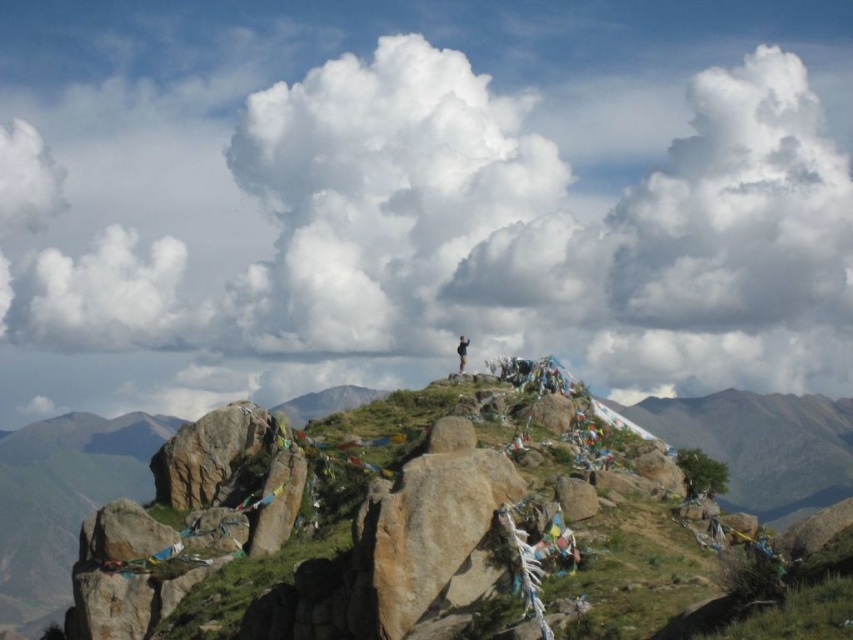
Based on the photo, is rusty rock at center in front of smooth brown rock at center?

No.

Which is in front, point (178, 480) or point (577, 520)?

Point (577, 520)

Locate an element on the screen. The image size is (853, 640). rusty rock at center is located at coordinates (209, 454).

Does rusty rock at center have a smaller size compared to black fabric person at center?

No, rusty rock at center is not smaller than black fabric person at center.

Which of these two, rusty rock at center or black fabric person at center, stands shorter?

black fabric person at center is shorter.

Looking at this image, who is more forward, (186, 422) or (462, 355)?

Point (462, 355)

You are a GUI agent. You are given a task and a screenshot of the screen. Output one action in this format:
    pyautogui.click(x=<x>, y=<y>)
    Task: Click on the rusty rock at center
    
    Given the screenshot: What is the action you would take?
    tap(209, 454)

Does point (556, 483) come closer to viewer compared to point (460, 368)?

Yes, point (556, 483) is in front of point (460, 368).

Does smooth brown rock at center have a greater height compared to black fabric person at center?

No.

Between point (561, 508) and point (459, 365), which one is positioned behind?

Point (459, 365)

Find the location of a particular element. smooth brown rock at center is located at coordinates (x=576, y=499).